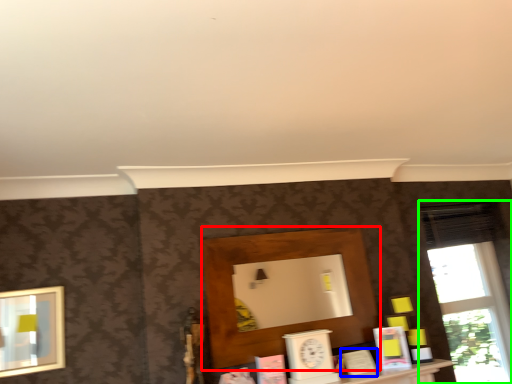
Question: Which is farther away from shelf (highlighted by a red box)? book (highlighted by a blue box) or window (highlighted by a green box)?

Choices:
 (A) book
 (B) window

Answer: (B)